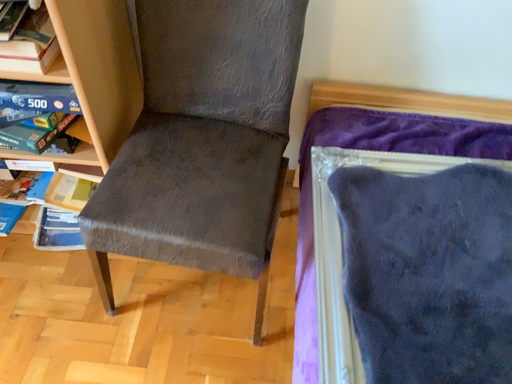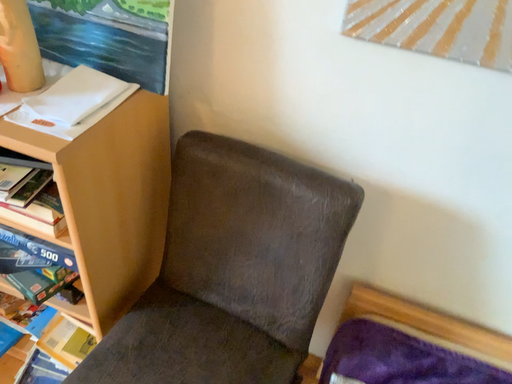
Question: How did the camera likely rotate when shooting the video?

Choices:
 (A) rotated left
 (B) rotated right

Answer: (A)